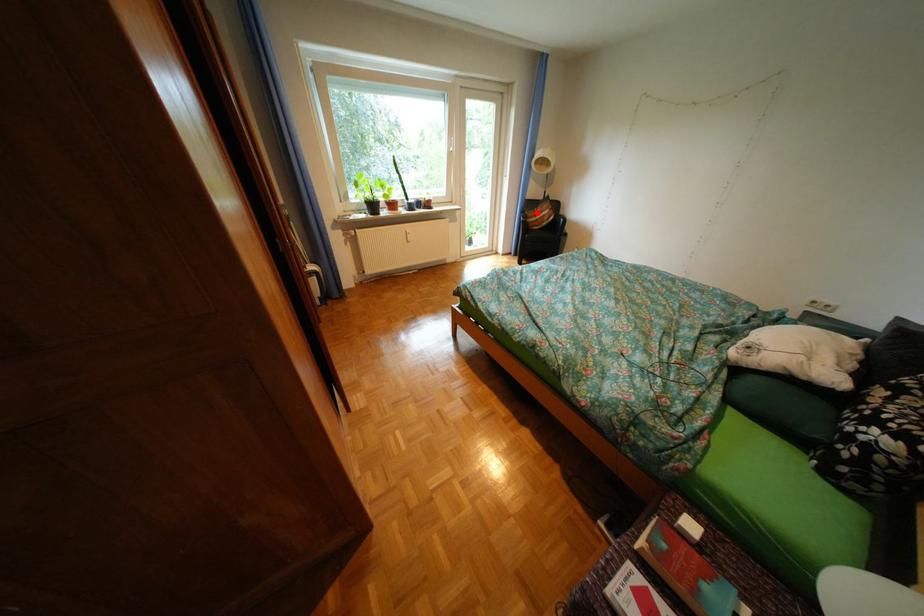
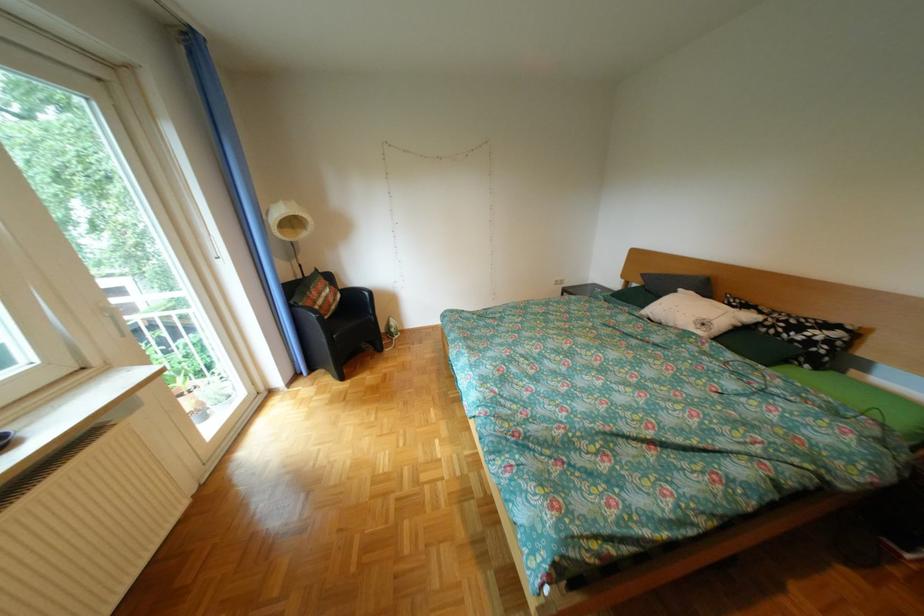
Question: I am providing you with two images of the same scene from different viewpoints. A red point is shown in image1. For the corresponding object point in image2, is it positioned nearer or farther from the camera?

Choices:
 (A) Nearer
 (B) Farther

Answer: (B)